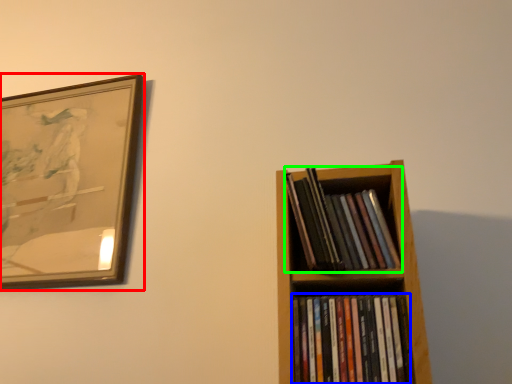
Question: Which object is positioned closest to picture frame (highlighted by a red box)? Select from book (highlighted by a blue box) and book (highlighted by a green box).

Choices:
 (A) book
 (B) book

Answer: (B)